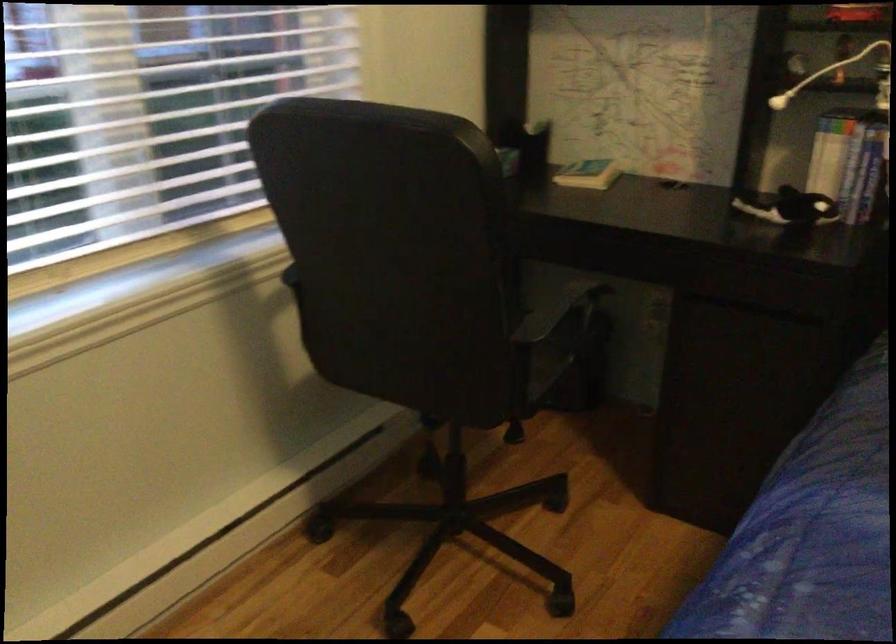
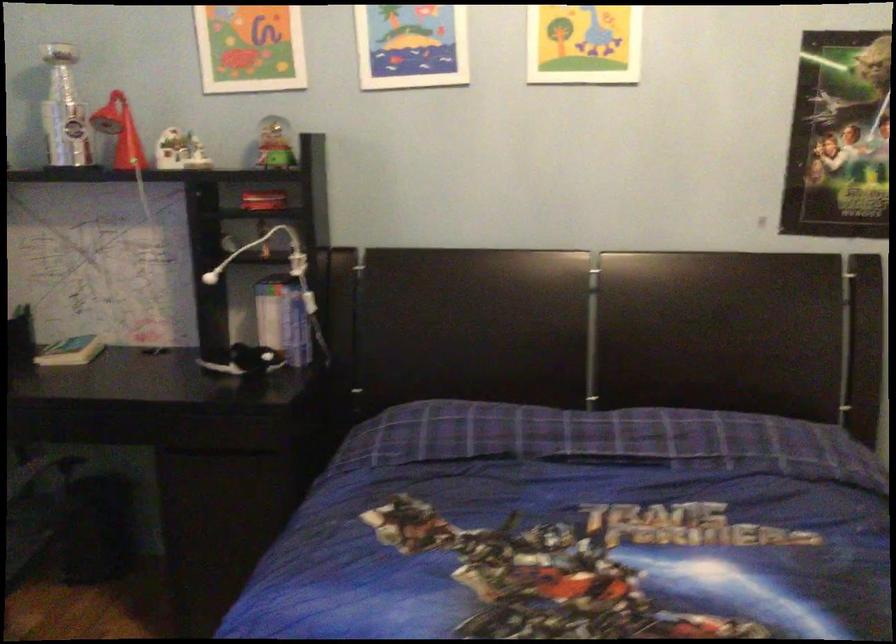
Question: The camera is either moving clockwise (left) or counter-clockwise (right) around the object. The first image is from the beginning of the video and the second image is from the end. Is the camera moving left or right when shooting the video?

Choices:
 (A) Left
 (B) Right

Answer: (A)